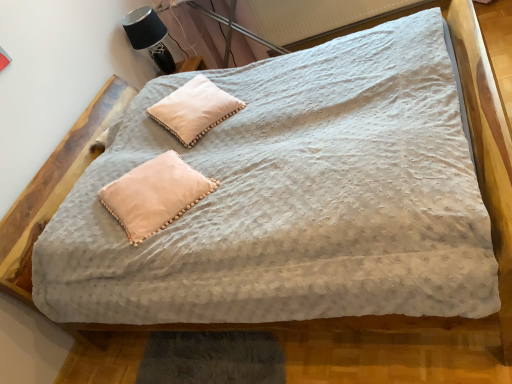
What is the approximate width of black fabric table lamp at upper left?

It is 11.52 inches.

In order to face white textured radiator at upper center, should I rotate leftwards or rightwards?

To face it directly, rotate right by 11.134 degrees.

This screenshot has width=512, height=384. I want to click on black fabric table lamp at upper left, so click(149, 36).

Which is behind, black fabric table lamp at upper left or white textured radiator at upper center?

black fabric table lamp at upper left is behind.

Which object is positioned more to the right, black fabric table lamp at upper left or white textured radiator at upper center?

white textured radiator at upper center is more to the right.

Based on their sizes in the image, would you say black fabric table lamp at upper left is bigger or smaller than white textured radiator at upper center?

In the image, black fabric table lamp at upper left appears to be smaller than white textured radiator at upper center.

The width and height of the screenshot is (512, 384). In the image, there is a black fabric table lamp at upper left. In order to click on radiator below it (from a real-world perspective) in this screenshot , I will do `click(323, 18)`.

Consider the image. Considering the sizes of objects black fabric table lamp at upper left and white soft pillow at upper center, the 1th pillow in the top-to-bottom sequence, in the image provided, who is smaller, black fabric table lamp at upper left or white soft pillow at upper center, the 1th pillow in the top-to-bottom sequence,?

Smaller between the two is white soft pillow at upper center, the 1th pillow in the top-to-bottom sequence.

Is black fabric table lamp at upper left aimed at white soft pillow at upper center, the second pillow positioned from the bottom?

No.

Is black fabric table lamp at upper left touching white soft pillow at upper center, the 1th pillow in the top-to-bottom sequence?

No, black fabric table lamp at upper left is not in contact with white soft pillow at upper center, the 1th pillow in the top-to-bottom sequence.

Is white textured radiator at upper center not within white soft pillow at upper center, the 1th pillow in the top-to-bottom sequence?

Yes, white textured radiator at upper center is located beyond the bounds of white soft pillow at upper center, the 1th pillow in the top-to-bottom sequence.

Based on the photo, which point is more distant from viewer, (x=302, y=12) or (x=174, y=97)?

The point (x=302, y=12) is farther.

How many degrees apart are the facing directions of white textured radiator at upper center and white soft pillow at upper center, the second pillow positioned from the bottom?

There is a 52-degree angle between the facing directions of white textured radiator at upper center and white soft pillow at upper center, the second pillow positioned from the bottom.

Is white textured radiator at upper center further to the viewer compared to white soft pillow at upper center, the 1th pillow in the top-to-bottom sequence?

Yes, it is.

From a real-world perspective, which is physically below, white soft pillow at upper center, the second pillow positioned from the bottom, or black fabric table lamp at upper left?

white soft pillow at upper center, the second pillow positioned from the bottom.

Is black fabric table lamp at upper left surrounded by white soft pillow at upper center, the second pillow positioned from the bottom?

No, black fabric table lamp at upper left is located outside of white soft pillow at upper center, the second pillow positioned from the bottom.

Is white soft pillow at upper center, acting as the second pillow starting from the front, taller than black fabric table lamp at upper left?

Incorrect, the height of white soft pillow at upper center, acting as the second pillow starting from the front, is not larger of that of black fabric table lamp at upper left.

Considering the relative positions of white soft pillow at upper center, acting as the second pillow starting from the front, and black fabric table lamp at upper left in the image provided, is white soft pillow at upper center, acting as the second pillow starting from the front, to the left or to the right of black fabric table lamp at upper left?

From the image, it's evident that white soft pillow at upper center, acting as the second pillow starting from the front, is to the right of black fabric table lamp at upper left.

Who is shorter, white textured radiator at upper center or black fabric table lamp at upper left?

black fabric table lamp at upper left.

From the image's perspective, is white textured radiator at upper center below black fabric table lamp at upper left?

No, from the image's perspective, white textured radiator at upper center is not below black fabric table lamp at upper left.

In the image, is white textured radiator at upper center positioned in front of or behind black fabric table lamp at upper left?

white textured radiator at upper center is positioned closer to the viewer than black fabric table lamp at upper left.

In terms of width, does white textured radiator at upper center look wider or thinner when compared to black fabric table lamp at upper left?

Considering their sizes, white textured radiator at upper center looks slimmer than black fabric table lamp at upper left.

Is pale pink fabric pillow at center, arranged as the 2th pillow when viewed from the top, outside of white soft pillow at upper center, arranged as the 1th pillow when viewed from the back?

Yes.

Is pale pink fabric pillow at center, arranged as the 2th pillow when viewed from the top, smaller than white soft pillow at upper center, the 1th pillow in the top-to-bottom sequence?

Yes, pale pink fabric pillow at center, arranged as the 2th pillow when viewed from the top, is smaller than white soft pillow at upper center, the 1th pillow in the top-to-bottom sequence.

Is pale pink fabric pillow at center, arranged as the 2th pillow when viewed from the top, taller than white soft pillow at upper center, arranged as the 1th pillow when viewed from the back?

In fact, pale pink fabric pillow at center, arranged as the 2th pillow when viewed from the top, may be shorter than white soft pillow at upper center, arranged as the 1th pillow when viewed from the back.

Between point (208, 111) and point (114, 206), which one is positioned behind?

Positioned behind is point (208, 111).

From their relative heights in the image, would you say white soft pillow at upper center, acting as the second pillow starting from the front, is taller or shorter than pale pink fabric pillow at center, arranged as the 2th pillow when viewed from the top?

Considering their sizes, white soft pillow at upper center, acting as the second pillow starting from the front, has more height than pale pink fabric pillow at center, arranged as the 2th pillow when viewed from the top.

How many degrees apart are the facing directions of white soft pillow at upper center, the second pillow positioned from the bottom, and pale pink fabric pillow at center, acting as the 1th pillow starting from the bottom?

They differ by 0.1 degrees in their facing directions.

You are a GUI agent. You are given a task and a screenshot of the screen. Output one action in this format:
    pyautogui.click(x=<x>, y=<y>)
    Task: Click on the pillow that is on the left side of white soft pillow at upper center, acting as the second pillow starting from the front
    
    Given the screenshot: What is the action you would take?
    pyautogui.click(x=155, y=195)

You are a GUI agent. You are given a task and a screenshot of the screen. Output one action in this format:
    pyautogui.click(x=<x>, y=<y>)
    Task: Click on the table lamp above the white textured radiator at upper center (from a real-world perspective)
    Image resolution: width=512 pixels, height=384 pixels.
    Given the screenshot: What is the action you would take?
    tap(149, 36)

At what (x,y) coordinates should I click in order to perform the action: click on table lamp lying on the left of white soft pillow at upper center, arranged as the 1th pillow when viewed from the back. Please return your answer as a coordinate pair (x, y). This screenshot has width=512, height=384. Looking at the image, I should click on (149, 36).

Which object lies nearer to the anchor point black fabric table lamp at upper left, white soft pillow at upper center, arranged as the 1th pillow when viewed from the back, or white textured radiator at upper center?

white soft pillow at upper center, arranged as the 1th pillow when viewed from the back, is closer to black fabric table lamp at upper left.

From the image, which object appears to be nearer to pale pink fabric pillow at center, acting as the 1th pillow starting from the bottom, black fabric table lamp at upper left or white soft pillow at upper center, acting as the second pillow starting from the front?

The object closer to pale pink fabric pillow at center, acting as the 1th pillow starting from the bottom, is white soft pillow at upper center, acting as the second pillow starting from the front.

Considering their positions, is white soft pillow at upper center, arranged as the 1th pillow when viewed from the back, positioned closer to black fabric table lamp at upper left than pale pink fabric pillow at center, acting as the 1th pillow starting from the bottom?

white soft pillow at upper center, arranged as the 1th pillow when viewed from the back, is closer to black fabric table lamp at upper left.

When comparing their distances from white soft pillow at upper center, the second pillow positioned from the bottom, does white textured radiator at upper center or black fabric table lamp at upper left seem further?

Based on the image, white textured radiator at upper center appears to be further to white soft pillow at upper center, the second pillow positioned from the bottom.

Considering their positions, is white textured radiator at upper center positioned closer to white soft pillow at upper center, the second pillow positioned from the bottom, than pale pink fabric pillow at center, the 1th pillow in the front-to-back sequence?

pale pink fabric pillow at center, the 1th pillow in the front-to-back sequence, lies closer to white soft pillow at upper center, the second pillow positioned from the bottom, than the other object.

Based on their spatial positions, is pale pink fabric pillow at center, acting as the 1th pillow starting from the bottom, or black fabric table lamp at upper left further from white textured radiator at upper center?

Among the two, pale pink fabric pillow at center, acting as the 1th pillow starting from the bottom, is located further to white textured radiator at upper center.

Looking at the image, which one is located closer to black fabric table lamp at upper left, pale pink fabric pillow at center, the 1th pillow in the front-to-back sequence, or white soft pillow at upper center, the second pillow positioned from the bottom?

white soft pillow at upper center, the second pillow positioned from the bottom.

Based on their spatial positions, is white textured radiator at upper center or white soft pillow at upper center, arranged as the 1th pillow when viewed from the back, further from pale pink fabric pillow at center, arranged as the 2th pillow when viewed from the top?

The object further to pale pink fabric pillow at center, arranged as the 2th pillow when viewed from the top, is white textured radiator at upper center.

At what (x,y) coordinates should I click in order to perform the action: click on pillow between pale pink fabric pillow at center, the 1th pillow in the front-to-back sequence, and black fabric table lamp at upper left in the front-back direction. Please return your answer as a coordinate pair (x, y). The height and width of the screenshot is (384, 512). Looking at the image, I should click on (194, 109).

Locate an element on the screen. pillow between white textured radiator at upper center and pale pink fabric pillow at center, positioned as the second pillow in back-to-front order, from top to bottom is located at coordinates (194, 109).

What are the coordinates of `table lamp between white textured radiator at upper center and pale pink fabric pillow at center, arranged as the 2th pillow when viewed from the top, vertically` in the screenshot? It's located at (149, 36).